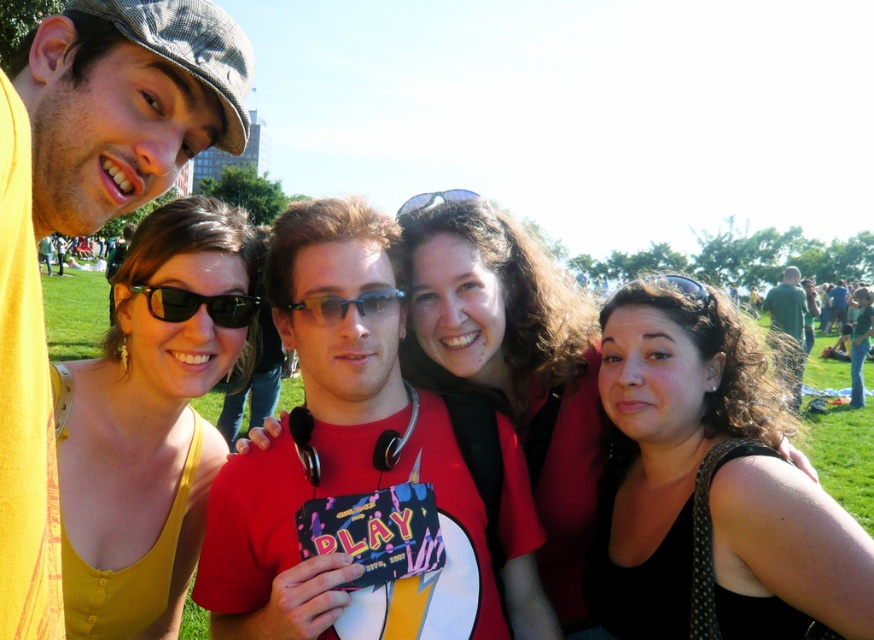
Based on the photo, you are a photographer trying to capture a group photo. You notice the black fabric at center and the green matte shirt at right in the scene. Which one should you adjust in your composition to ensure both are clearly visible?

The black fabric at center has a smaller size compared to green matte shirt at right, so you should adjust the position of the black fabric at center to make it larger or move it closer to the camera to ensure it is clearly visible.